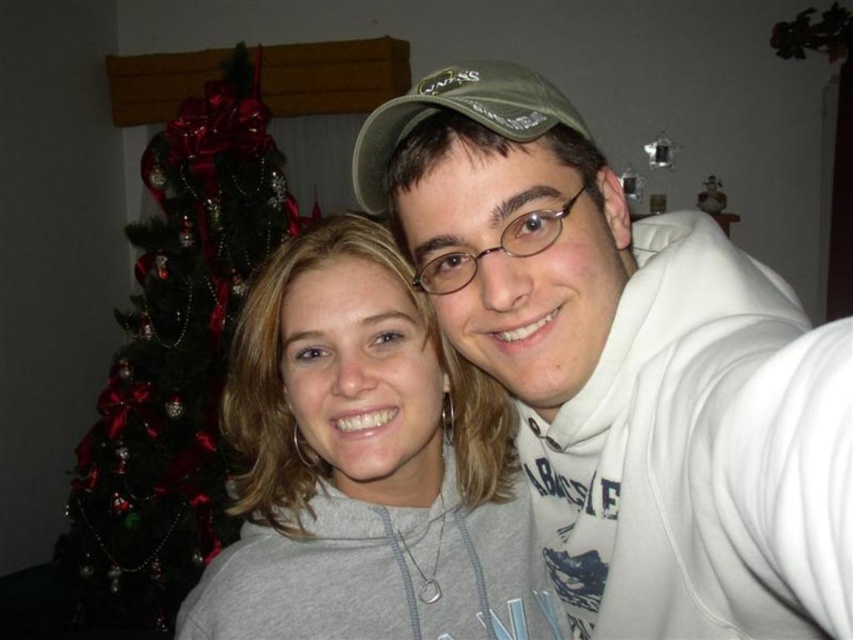
Who is positioned more to the right, white fleece sweatshirt at center or gray matte sweatshirt at center?

Positioned to the right is white fleece sweatshirt at center.

Between point (701, 276) and point (254, 508), which one is positioned in front?

Point (701, 276) is more forward.

Which is in front, point (572, 470) or point (241, 632)?

Point (241, 632) is more forward.

Locate an element on the screen. The width and height of the screenshot is (853, 640). white fleece sweatshirt at center is located at coordinates (627, 369).

Which of these two, white fleece sweatshirt at center or green matte christmas tree at left, stands shorter?

With less height is white fleece sweatshirt at center.

Who is more forward, (x=563, y=148) or (x=201, y=339)?

Point (x=563, y=148) is in front.

Is point (840, 332) closer to camera compared to point (140, 292)?

Yes, it is in front of point (140, 292).

In order to click on white fleece sweatshirt at center in this screenshot , I will do `click(627, 369)`.

Between gray matte sweatshirt at center and green matte christmas tree at left, which one has more height?

With more height is green matte christmas tree at left.

Is gray matte sweatshirt at center positioned behind green matte christmas tree at left?

No, it is not.

Does point (376, 276) come farther from viewer compared to point (229, 300)?

That is False.

Identify the location of gray matte sweatshirt at center. (364, 465).